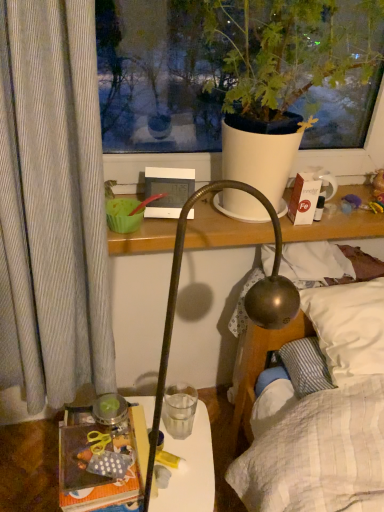
Question: From a real-world perspective, does white cardboard box at upper right sit lower than transparent glass at center?

Choices:
 (A) no
 (B) yes

Answer: (A)

Question: Is white cardboard box at upper right taller than transparent glass at center?

Choices:
 (A) yes
 (B) no

Answer: (A)

Question: Does white cardboard box at upper right have a larger size compared to transparent glass at center?

Choices:
 (A) yes
 (B) no

Answer: (B)

Question: Is white cardboard box at upper right behind transparent glass at center?

Choices:
 (A) no
 (B) yes

Answer: (A)

Question: Would you say white cardboard box at upper right is outside transparent glass at center?

Choices:
 (A) no
 (B) yes

Answer: (B)

Question: Does white cardboard box at upper right contain transparent glass at center?

Choices:
 (A) no
 (B) yes

Answer: (A)

Question: From a real-world perspective, is translucent plastic table at lower left located higher than polka dot fabric book at lower left?

Choices:
 (A) yes
 (B) no

Answer: (B)

Question: Does translucent plastic table at lower left come in front of polka dot fabric book at lower left?

Choices:
 (A) yes
 (B) no

Answer: (B)

Question: From the image's perspective, is translucent plastic table at lower left on polka dot fabric book at lower left?

Choices:
 (A) yes
 (B) no

Answer: (B)

Question: Considering the relative positions of translucent plastic table at lower left and polka dot fabric book at lower left in the image provided, is translucent plastic table at lower left to the left of polka dot fabric book at lower left from the viewer's perspective?

Choices:
 (A) no
 (B) yes

Answer: (A)

Question: Is translucent plastic table at lower left directly adjacent to polka dot fabric book at lower left?

Choices:
 (A) no
 (B) yes

Answer: (A)

Question: Is translucent plastic table at lower left thinner than polka dot fabric book at lower left?

Choices:
 (A) yes
 (B) no

Answer: (B)

Question: Considering the relative sizes of white cardboard box at upper right and translucent plastic table at lower left in the image provided, is white cardboard box at upper right taller than translucent plastic table at lower left?

Choices:
 (A) no
 (B) yes

Answer: (A)